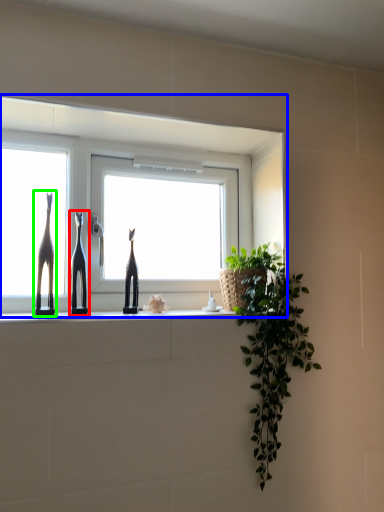
Question: Based on their relative distances, which object is farther from sculpture (highlighted by a red box)? Choose from window (highlighted by a blue box) and giraffe (highlighted by a green box).

Choices:
 (A) window
 (B) giraffe

Answer: (A)